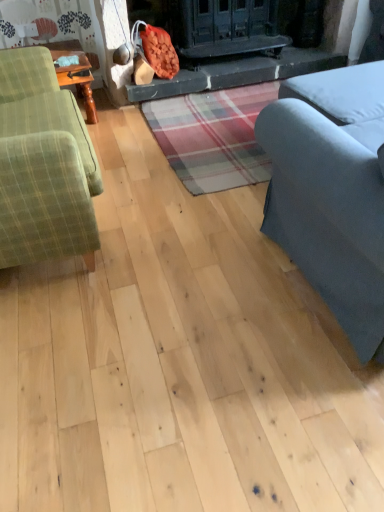
Question: Can you confirm if green plaid fabric couch at left, the 2th studio couch positioned from the right, is shorter than gray fabric couch at right, marked as the second studio couch in a left-to-right arrangement?

Choices:
 (A) yes
 (B) no

Answer: (A)

Question: Can you see green plaid fabric couch at left, acting as the first studio couch starting from the left, touching gray fabric couch at right, marked as the second studio couch in a left-to-right arrangement?

Choices:
 (A) yes
 (B) no

Answer: (B)

Question: Are green plaid fabric couch at left, the 2th studio couch positioned from the right, and gray fabric couch at right, marked as the second studio couch in a left-to-right arrangement, located far from each other?

Choices:
 (A) yes
 (B) no

Answer: (B)

Question: Is green plaid fabric couch at left, the 2th studio couch positioned from the right, to the right of gray fabric couch at right, marked as the second studio couch in a left-to-right arrangement, from the viewer's perspective?

Choices:
 (A) yes
 (B) no

Answer: (B)

Question: Is green plaid fabric couch at left, acting as the first studio couch starting from the left, at the left side of gray fabric couch at right, marked as the second studio couch in a left-to-right arrangement?

Choices:
 (A) no
 (B) yes

Answer: (B)

Question: From a real-world perspective, relative to gray fabric couch at right, marked as the second studio couch in a left-to-right arrangement, is green plaid fabric couch at left, acting as the first studio couch starting from the left, vertically above or below?

Choices:
 (A) below
 (B) above

Answer: (A)

Question: Would you say green plaid fabric couch at left, the 2th studio couch positioned from the right, is to the left or to the right of gray fabric couch at right, the 1th studio couch viewed from the right, in the picture?

Choices:
 (A) right
 (B) left

Answer: (B)

Question: Which is correct: green plaid fabric couch at left, the 2th studio couch positioned from the right, is inside gray fabric couch at right, marked as the second studio couch in a left-to-right arrangement, or outside of it?

Choices:
 (A) inside
 (B) outside

Answer: (B)

Question: Is point [x=54, y=133] closer or farther from the camera than point [x=268, y=142]?

Choices:
 (A) farther
 (B) closer

Answer: (B)

Question: Looking at the image, does gray fabric couch at right, the 1th studio couch viewed from the right, seem bigger or smaller compared to smooth stone fireplace at center?

Choices:
 (A) small
 (B) big

Answer: (B)

Question: Does point (317, 134) appear closer or farther from the camera than point (201, 72)?

Choices:
 (A) farther
 (B) closer

Answer: (B)

Question: Is gray fabric couch at right, marked as the second studio couch in a left-to-right arrangement, taller or shorter than smooth stone fireplace at center?

Choices:
 (A) tall
 (B) short

Answer: (A)

Question: Visually, is gray fabric couch at right, the 1th studio couch viewed from the right, positioned to the left or to the right of smooth stone fireplace at center?

Choices:
 (A) left
 (B) right

Answer: (B)

Question: Relative to green plaid fabric couch at left, the 2th studio couch positioned from the right, is gray fabric couch at right, the 1th studio couch viewed from the right, in front or behind?

Choices:
 (A) behind
 (B) front

Answer: (B)

Question: Based on their positions, is gray fabric couch at right, the 1th studio couch viewed from the right, located to the left or right of green plaid fabric couch at left, the 2th studio couch positioned from the right?

Choices:
 (A) right
 (B) left

Answer: (A)